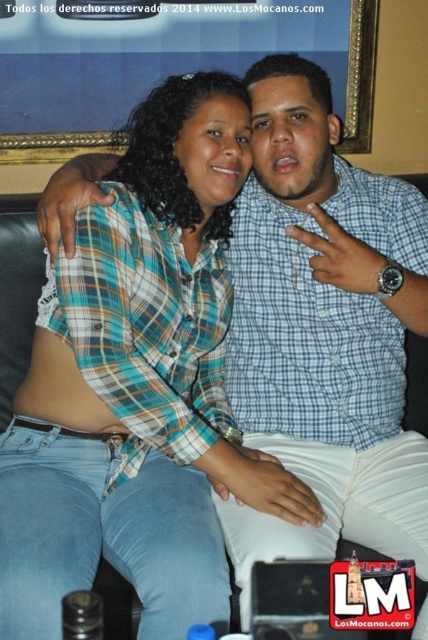
Question: Considering the relative positions of blue plaid shirt at center and blue checkered shirt at center in the image provided, where is blue plaid shirt at center located with respect to blue checkered shirt at center?

Choices:
 (A) above
 (B) below

Answer: (B)

Question: Is blue plaid shirt at center below blue checkered shirt at center?

Choices:
 (A) no
 (B) yes

Answer: (B)

Question: Which object is farther from the camera taking this photo?

Choices:
 (A) blue checkered shirt at center
 (B) blue plaid shirt at center

Answer: (B)

Question: Which object appears closest to the camera in this image?

Choices:
 (A) blue plaid shirt at center
 (B) blue checkered shirt at center

Answer: (B)

Question: From the image, what is the correct spatial relationship of blue plaid shirt at center in relation to blue checkered shirt at center?

Choices:
 (A) left
 (B) right

Answer: (A)

Question: Which point is closer to the camera taking this photo?

Choices:
 (A) coord(416,253)
 (B) coord(89,433)

Answer: (B)